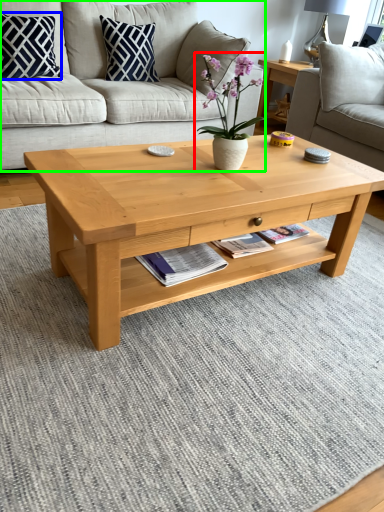
Question: Considering the real-world distances, which object is closest to houseplant (highlighted by a red box)? pillow (highlighted by a blue box) or studio couch (highlighted by a green box).

Choices:
 (A) pillow
 (B) studio couch

Answer: (B)